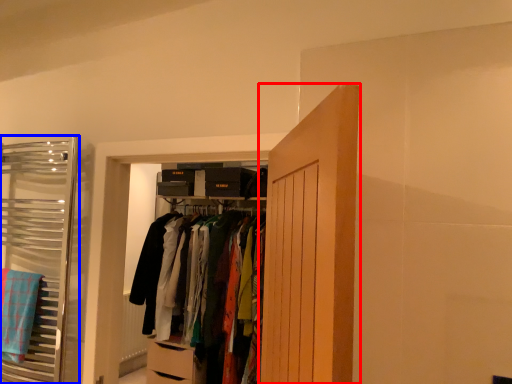
Question: Which point is further to the camera, door (highlighted by a red box) or closet (highlighted by a blue box)?

Choices:
 (A) door
 (B) closet

Answer: (B)